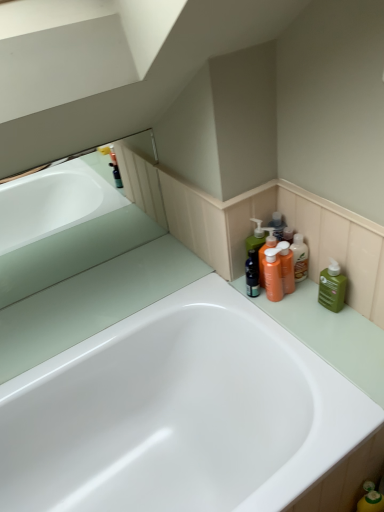
What is the approximate height of matte glass bathtub at upper left?

The height of matte glass bathtub at upper left is 17.24 inches.

At what (x,y) coordinates should I click in order to perform the action: click on translucent orange bottle at right. Please return your answer as a coordinate pair (x, y). Looking at the image, I should click on (300, 257).

Find the location of a particular element. Image resolution: width=384 pixels, height=512 pixels. green matte bottle at right, marked as the second cleaning product in a left-to-right arrangement is located at coordinates (332, 287).

From the image's perspective, which one is positioned higher, translucent orange bottle at right or matte glass bathtub at upper left?

matte glass bathtub at upper left, from the image's perspective.

From a real-world perspective, is translucent orange bottle at right positioned above or below matte glass bathtub at upper left?

From a real-world perspective, translucent orange bottle at right is physically below matte glass bathtub at upper left.

Is translucent orange bottle at right situated inside matte glass bathtub at upper left or outside?

translucent orange bottle at right cannot be found inside matte glass bathtub at upper left.

Who is shorter, translucent orange bottle at right or matte glass bathtub at upper left?

translucent orange bottle at right is shorter.

Can you confirm if orange matte pump bottle at upper right, the second cleaning product positioned from the right, is positioned to the right of white glossy bathtub at center?

Yes.

Is orange matte pump bottle at upper right, which is counted as the 1th cleaning product, starting from the left, looking in the opposite direction of white glossy bathtub at center?

No, orange matte pump bottle at upper right, which is counted as the 1th cleaning product, starting from the left,'s orientation is not away from white glossy bathtub at center.

From the picture: Does orange matte pump bottle at upper right, which is counted as the 1th cleaning product, starting from the left, come in front of white glossy bathtub at center?

That is False.

From a real-world perspective, is orange matte pump bottle at upper right, which is counted as the 1th cleaning product, starting from the left, positioned above or below white glossy bathtub at center?

orange matte pump bottle at upper right, which is counted as the 1th cleaning product, starting from the left, is above white glossy bathtub at center.

Can we say matte glass bathtub at upper left lies outside green matte bottle at right, marked as the second cleaning product in a left-to-right arrangement?

matte glass bathtub at upper left is positioned outside green matte bottle at right, marked as the second cleaning product in a left-to-right arrangement.

Looking at their sizes, would you say matte glass bathtub at upper left is wider or thinner than green matte bottle at right, acting as the 1th cleaning product starting from the right?

Considering their sizes, matte glass bathtub at upper left looks slimmer than green matte bottle at right, acting as the 1th cleaning product starting from the right.

Is matte glass bathtub at upper left closer to the viewer compared to green matte bottle at right, acting as the 1th cleaning product starting from the right?

No, matte glass bathtub at upper left is further to the viewer.

Is translucent orange bottle at right in contact with green matte bottle at right, marked as the second cleaning product in a left-to-right arrangement?

No, translucent orange bottle at right is not beside green matte bottle at right, marked as the second cleaning product in a left-to-right arrangement.

From the image's perspective, which object appears higher, translucent orange bottle at right or green matte bottle at right, marked as the second cleaning product in a left-to-right arrangement?

translucent orange bottle at right.

Is translucent orange bottle at right further to the viewer compared to green matte bottle at right, acting as the 1th cleaning product starting from the right?

That is True.

Who is shorter, translucent orange bottle at right or green matte bottle at right, marked as the second cleaning product in a left-to-right arrangement?

Standing shorter between the two is green matte bottle at right, marked as the second cleaning product in a left-to-right arrangement.

Does orange matte pump bottle at upper right, the second cleaning product positioned from the right, have a smaller size compared to matte glass bathtub at upper left?

Indeed, orange matte pump bottle at upper right, the second cleaning product positioned from the right, has a smaller size compared to matte glass bathtub at upper left.

Measure the distance from orange matte pump bottle at upper right, the second cleaning product positioned from the right, to matte glass bathtub at upper left.

30.37 inches.

How different are the orientations of orange matte pump bottle at upper right, the second cleaning product positioned from the right, and matte glass bathtub at upper left in degrees?

orange matte pump bottle at upper right, the second cleaning product positioned from the right, and matte glass bathtub at upper left are facing 88.2 degrees away from each other.

Is there a large distance between orange matte pump bottle at upper right, the second cleaning product positioned from the right, and matte glass bathtub at upper left?

That's not correct — orange matte pump bottle at upper right, the second cleaning product positioned from the right, is a little close to matte glass bathtub at upper left.

Who is bigger, translucent orange bottle at right or orange matte pump bottle at upper right, the second cleaning product positioned from the right?

orange matte pump bottle at upper right, the second cleaning product positioned from the right.

Is translucent orange bottle at right outside of orange matte pump bottle at upper right, which is counted as the 1th cleaning product, starting from the left?

Yes, translucent orange bottle at right is not within orange matte pump bottle at upper right, which is counted as the 1th cleaning product, starting from the left.

Considering the positions of objects translucent orange bottle at right and orange matte pump bottle at upper right, which is counted as the 1th cleaning product, starting from the left, in the image provided, who is in front, translucent orange bottle at right or orange matte pump bottle at upper right, which is counted as the 1th cleaning product, starting from the left,?

Positioned in front is orange matte pump bottle at upper right, which is counted as the 1th cleaning product, starting from the left.

From the image's perspective, is matte glass bathtub at upper left above or below orange matte pump bottle at upper right, the second cleaning product positioned from the right?

matte glass bathtub at upper left is situated higher than orange matte pump bottle at upper right, the second cleaning product positioned from the right, in the image.

Which is in front, point (99, 249) or point (271, 259)?

The point (271, 259) is closer.

Which object is closer to the camera, matte glass bathtub at upper left or orange matte pump bottle at upper right, which is counted as the 1th cleaning product, starting from the left?

orange matte pump bottle at upper right, which is counted as the 1th cleaning product, starting from the left, is more forward.

Can you tell me how much matte glass bathtub at upper left and orange matte pump bottle at upper right, which is counted as the 1th cleaning product, starting from the left, differ in facing direction?

88.2 degrees.

Locate an element on the screen. mouthwash below the matte glass bathtub at upper left (from the image's perspective) is located at coordinates (300, 257).

This screenshot has height=512, width=384. I want to click on bathtub in front of the orange matte pump bottle at upper right, which is counted as the 1th cleaning product, starting from the left, so click(x=179, y=414).

When comparing their distances from white glossy bathtub at center, does translucent orange bottle at right or green matte bottle at right, acting as the 1th cleaning product starting from the right, seem further?

translucent orange bottle at right lies further to white glossy bathtub at center than the other object.

Based on their spatial positions, is matte glass bathtub at upper left or orange matte pump bottle at upper right, which is counted as the 1th cleaning product, starting from the left, closer to translucent orange bottle at right?

orange matte pump bottle at upper right, which is counted as the 1th cleaning product, starting from the left, lies closer to translucent orange bottle at right than the other object.

Looking at the image, which one is located further to translucent orange bottle at right, green matte bottle at right, acting as the 1th cleaning product starting from the right, or matte glass bathtub at upper left?

matte glass bathtub at upper left lies further to translucent orange bottle at right than the other object.

Looking at the image, which one is located further to green matte bottle at right, acting as the 1th cleaning product starting from the right, orange matte pump bottle at upper right, the second cleaning product positioned from the right, or white glossy bathtub at center?

white glossy bathtub at center is further to green matte bottle at right, acting as the 1th cleaning product starting from the right.

Considering their positions, is green matte bottle at right, marked as the second cleaning product in a left-to-right arrangement, positioned further to white glossy bathtub at center than translucent orange bottle at right?

translucent orange bottle at right is positioned further to the anchor white glossy bathtub at center.

Looking at the image, which one is located closer to green matte bottle at right, acting as the 1th cleaning product starting from the right, orange matte pump bottle at upper right, which is counted as the 1th cleaning product, starting from the left, or translucent orange bottle at right?

translucent orange bottle at right lies closer to green matte bottle at right, acting as the 1th cleaning product starting from the right, than the other object.

Which object lies further to the anchor point matte glass bathtub at upper left, translucent orange bottle at right or white glossy bathtub at center?

translucent orange bottle at right is positioned further to the anchor matte glass bathtub at upper left.

Consider the image. Considering their positions, is orange matte pump bottle at upper right, the second cleaning product positioned from the right, positioned further to matte glass bathtub at upper left than white glossy bathtub at center?

orange matte pump bottle at upper right, the second cleaning product positioned from the right.

Where is `mouthwash between orange matte pump bottle at upper right, the second cleaning product positioned from the right, and green matte bottle at right, marked as the second cleaning product in a left-to-right arrangement, from left to right`? This screenshot has width=384, height=512. mouthwash between orange matte pump bottle at upper right, the second cleaning product positioned from the right, and green matte bottle at right, marked as the second cleaning product in a left-to-right arrangement, from left to right is located at coordinates (300, 257).

Where is `cleaning product located between matte glass bathtub at upper left and green matte bottle at right, acting as the 1th cleaning product starting from the right, in the left-right direction`? cleaning product located between matte glass bathtub at upper left and green matte bottle at right, acting as the 1th cleaning product starting from the right, in the left-right direction is located at coordinates tap(273, 275).

I want to click on cleaning product between matte glass bathtub at upper left and translucent orange bottle at right, so click(x=273, y=275).

At what (x,y) coordinates should I click in order to perform the action: click on cleaning product between white glossy bathtub at center and orange matte pump bottle at upper right, the second cleaning product positioned from the right, from front to back. Please return your answer as a coordinate pair (x, y). Image resolution: width=384 pixels, height=512 pixels. Looking at the image, I should click on (332, 287).